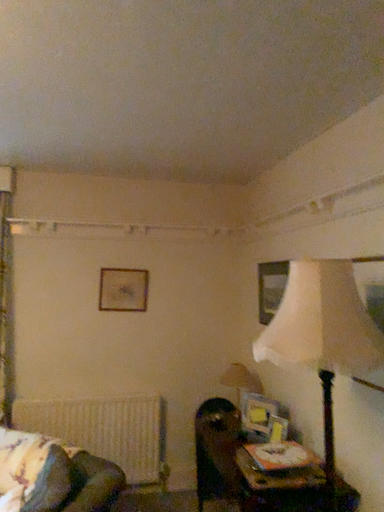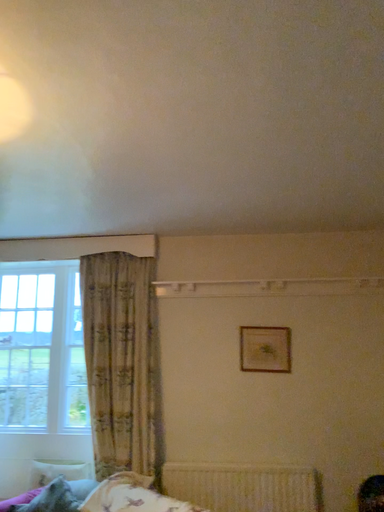
Question: Which way did the camera rotate in the video?

Choices:
 (A) rotated downward
 (B) rotated upward

Answer: (B)